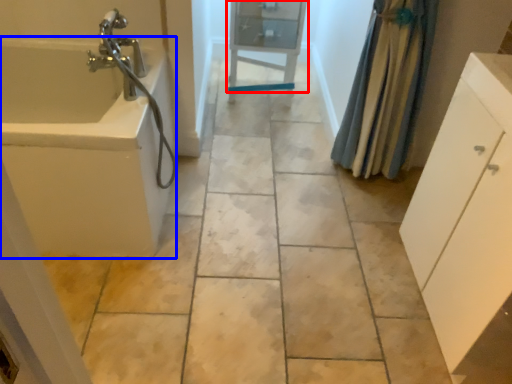
Question: Which of the following is the farthest to the observer, cabinetry (highlighted by a red box) or bath (highlighted by a blue box)?

Choices:
 (A) cabinetry
 (B) bath

Answer: (A)